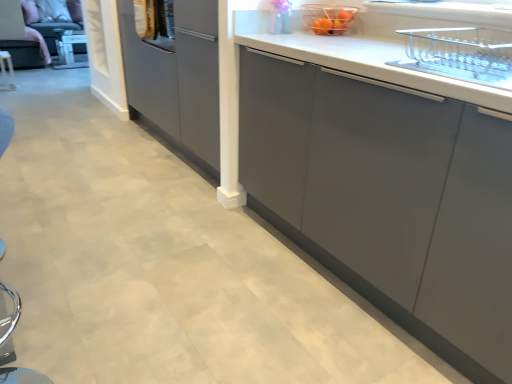
Question: Does point (6, 64) appear closer or farther from the camera than point (352, 8)?

Choices:
 (A) farther
 (B) closer

Answer: (A)

Question: Considering the positions of metallic silver knife at left and translucent plastic basket at upper center in the image, is metallic silver knife at left taller or shorter than translucent plastic basket at upper center?

Choices:
 (A) short
 (B) tall

Answer: (B)

Question: From the image's perspective, relative to translucent plastic basket at upper center, is metallic silver knife at left above or below?

Choices:
 (A) above
 (B) below

Answer: (A)

Question: From a real-world perspective, is translucent plastic basket at upper center above or below metallic silver knife at left?

Choices:
 (A) below
 (B) above

Answer: (B)

Question: Is point (355, 8) positioned closer to the camera than point (6, 74)?

Choices:
 (A) farther
 (B) closer

Answer: (B)

Question: Considering the positions of translucent plastic basket at upper center and metallic silver knife at left in the image, is translucent plastic basket at upper center taller or shorter than metallic silver knife at left?

Choices:
 (A) short
 (B) tall

Answer: (A)

Question: Considering the positions of translucent plastic basket at upper center and metallic silver knife at left in the image, is translucent plastic basket at upper center wider or thinner than metallic silver knife at left?

Choices:
 (A) wide
 (B) thin

Answer: (A)